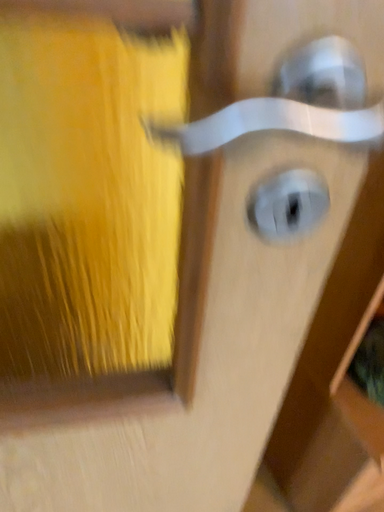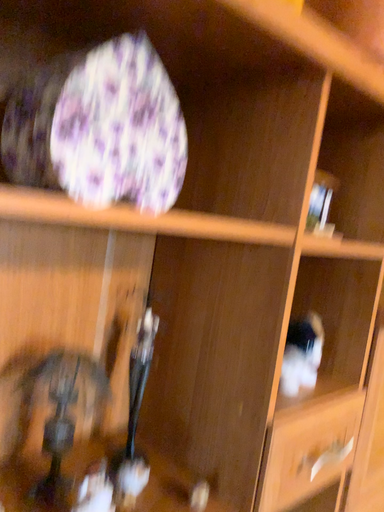
Question: Which way did the camera rotate in the video?

Choices:
 (A) rotated upward
 (B) rotated downward

Answer: (A)